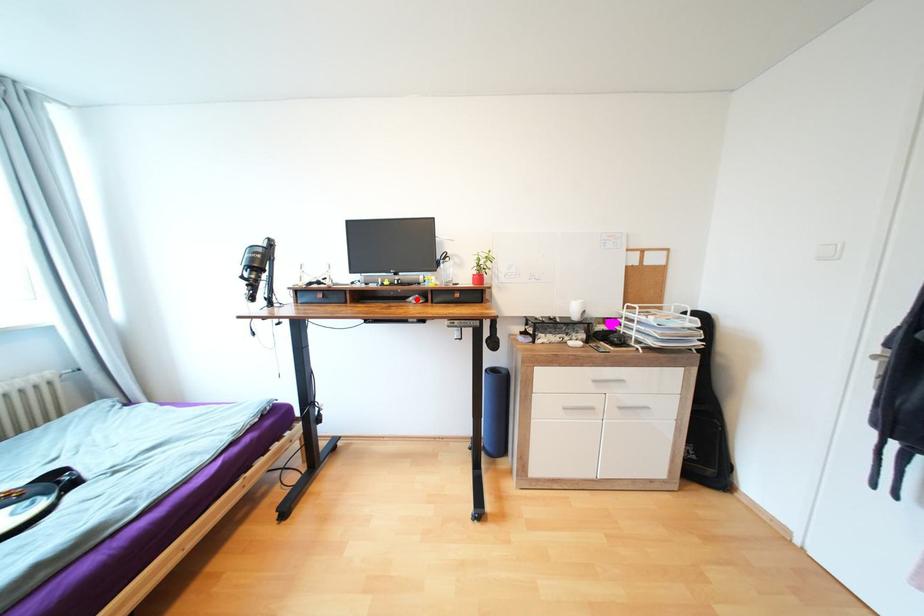
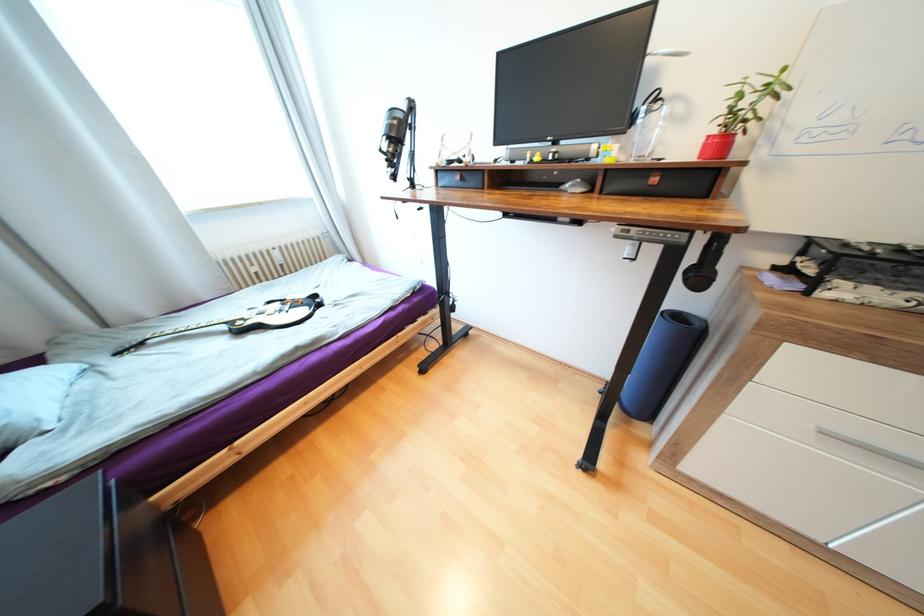
In the second image, find the point that corresponds to the highlighted location in the first image.

(574, 185)